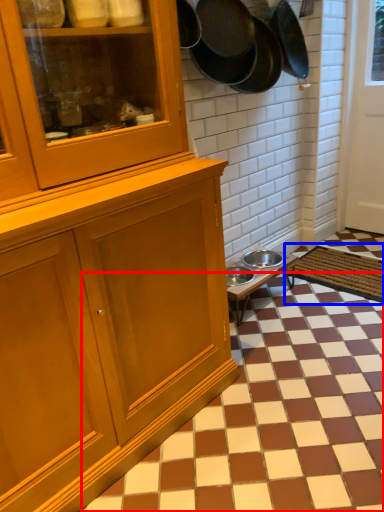
Question: Which object appears farthest to the camera in this image, tile (highlighted by a red box) or doormat (highlighted by a blue box)?

Choices:
 (A) tile
 (B) doormat

Answer: (B)